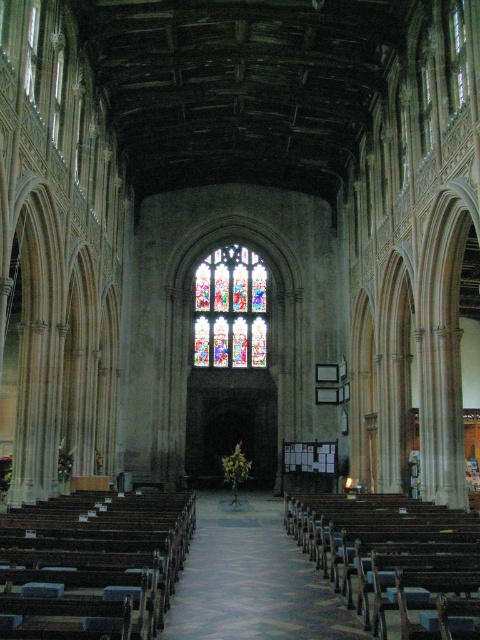
You are standing at the entrance of the cathedral and want to sit down. There is a wooden polished bench at center and a stained glass window at center. Which one is closer to you?

The wooden polished bench at center is closer to you since it is in front of the stained glass window at center.

From the picture: You are standing at the entrance of the cathedral and see two points marked on the floor. The first point is labeled as point (90,589) and the second is point (225,346). Which point is closer to you?

Point (90,589) is closer to you because it is in front of point (225,346).

You are an interior designer planning to place a 2.5 meter wide sculpture in the cathedral. You have two options for placement locations based on available space. The first option is next to the wooden polished bench at lower left, and the second is near the wooden polished pews at center. Which location offers more space for the sculpture?

The wooden polished bench at lower left has a greater width than the wooden polished pews at center, so placing the sculpture next to the wooden polished bench at lower left would provide more space for the 2.5 meter wide sculpture.